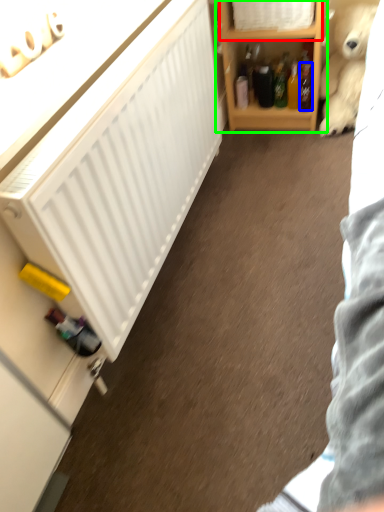
Question: Based on their relative distances, which object is nearer to cabinet (highlighted by a red box)? Choose from bottle (highlighted by a blue box) and shelf (highlighted by a green box).

Choices:
 (A) bottle
 (B) shelf

Answer: (B)